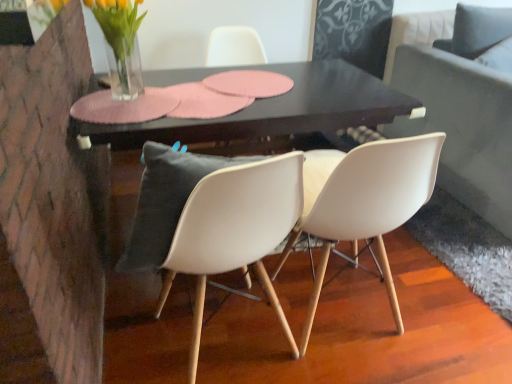
Locate an element on the screen. The width and height of the screenshot is (512, 384). blank space to the left of white plastic chair at center, the 3th chair viewed from the back is located at coordinates (144, 339).